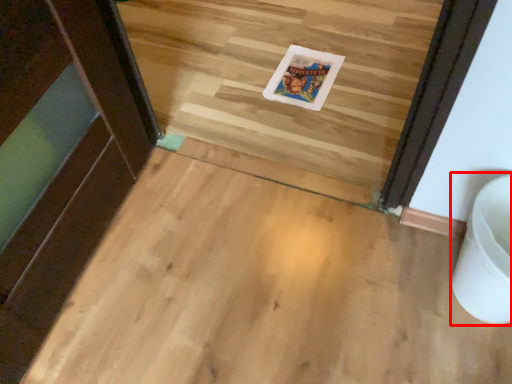
Question: From the image's perspective, where is toilet bowl (annotated by the red box) located relative to postcard?

Choices:
 (A) below
 (B) above

Answer: (A)